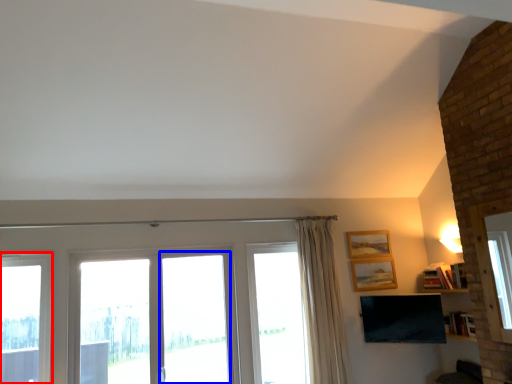
Question: Which of the following is the farthest to the observer, window (highlighted by a red box) or screen door (highlighted by a blue box)?

Choices:
 (A) window
 (B) screen door

Answer: (B)